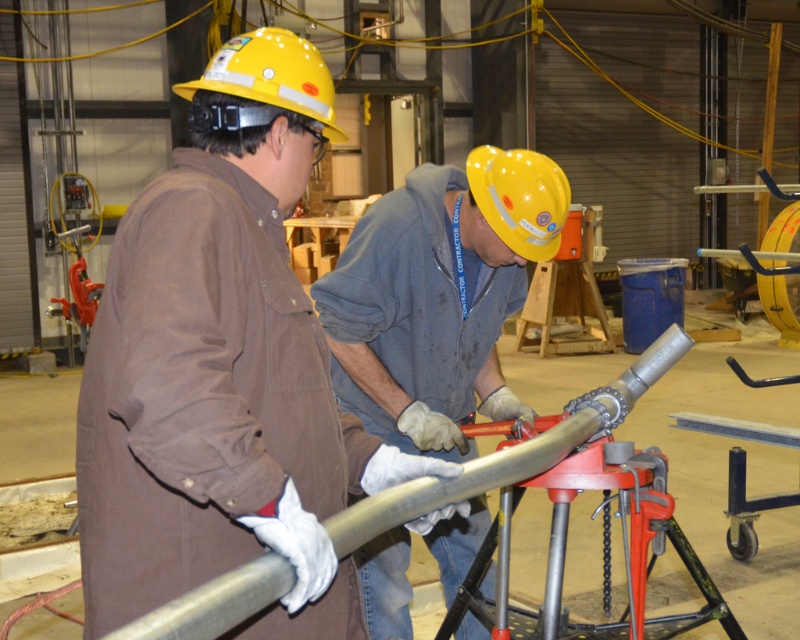
Who is more forward, (389, 403) or (214, 52)?

Point (389, 403) is more forward.

Does matte gray pipe at center appear under yellow hard hat at upper center?

A: Yes.

Which is in front, point (416, 250) or point (220, 81)?

Point (220, 81)

Image resolution: width=800 pixels, height=640 pixels. What are the coordinates of `matte gray pipe at center` in the screenshot? It's located at (438, 296).

Between yellow hard hat at upper center and yellow matte hard hat at center, which one appears on the right side from the viewer's perspective?

yellow matte hard hat at center

Describe the element at coordinates (272, 74) in the screenshot. I see `yellow hard hat at upper center` at that location.

Image resolution: width=800 pixels, height=640 pixels. What are the coordinates of `yellow hard hat at upper center` in the screenshot? It's located at (272, 74).

Who is taller, matte gray pipe at center or yellow matte hard hat at center?

matte gray pipe at center

What do you see at coordinates (438, 296) in the screenshot? I see `matte gray pipe at center` at bounding box center [438, 296].

Which is behind, point (494, 234) or point (538, 163)?

Point (494, 234)

Locate an element on the screen. This screenshot has width=800, height=640. matte gray pipe at center is located at coordinates (438, 296).